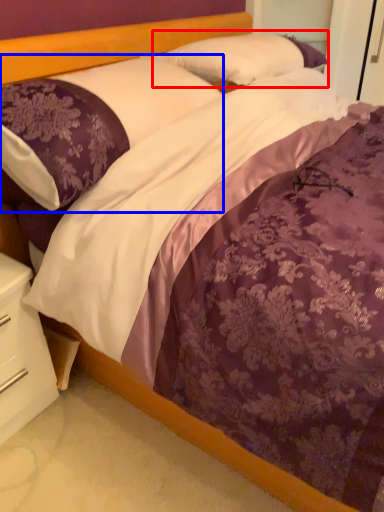
Question: Which object appears closest to the camera in this image, pillow (highlighted by a red box) or pillow (highlighted by a blue box)?

Choices:
 (A) pillow
 (B) pillow

Answer: (B)